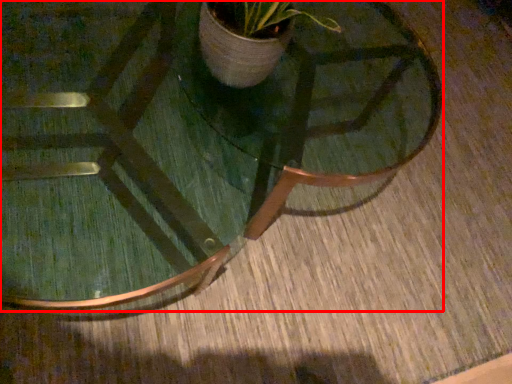
Question: From the image's perspective, where is coffee table (annotated by the red box) located in relation to round table in the image?

Choices:
 (A) above
 (B) below

Answer: (B)